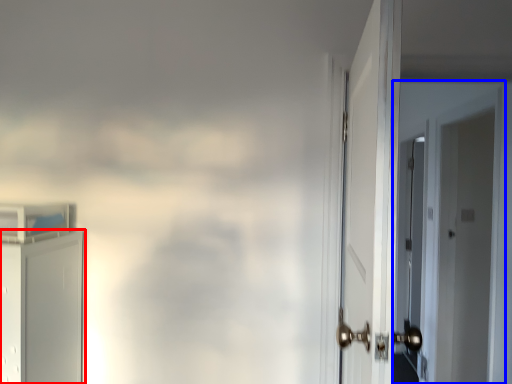
Question: Among these objects, which one is farthest to the camera, door (highlighted by a red box) or door (highlighted by a blue box)?

Choices:
 (A) door
 (B) door

Answer: (B)